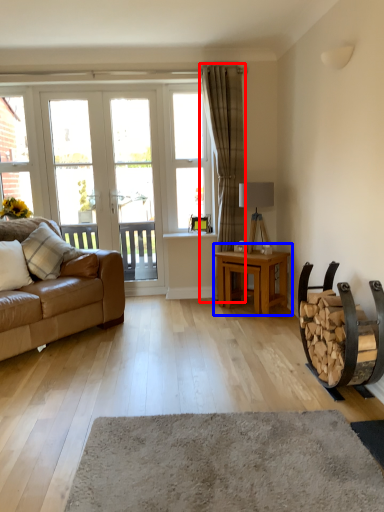
Question: Which of the following is the closest to the observer, curtain (highlighted by a red box) or table (highlighted by a blue box)?

Choices:
 (A) curtain
 (B) table

Answer: (B)